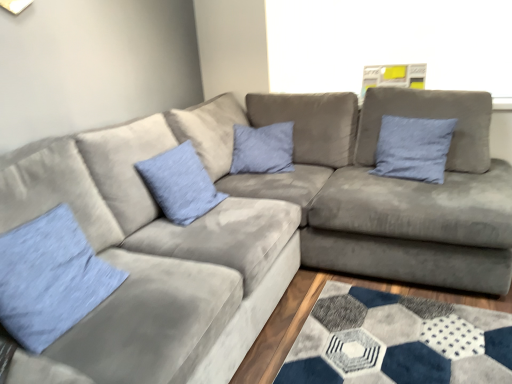
Question: Should I look upward or downward to see blue fabric pillow at center, which appears as the second pillow when viewed from the right?

Choices:
 (A) down
 (B) up

Answer: (B)

Question: Is blue fabric pillow at center, which appears as the second pillow when viewed from the right, aimed at light blue fabric pillow at lower left, the first pillow from the front?

Choices:
 (A) yes
 (B) no

Answer: (B)

Question: Is there a large distance between blue fabric pillow at center, the second pillow positioned from the front, and light blue fabric pillow at lower left, the first pillow from the front?

Choices:
 (A) yes
 (B) no

Answer: (B)

Question: From the image's perspective, is blue fabric pillow at center, which is counted as the 2th pillow, starting from the back, over light blue fabric pillow at lower left, the 1th pillow viewed from the left?

Choices:
 (A) yes
 (B) no

Answer: (A)

Question: Can you confirm if blue fabric pillow at center, which is counted as the 2th pillow, starting from the back, is bigger than light blue fabric pillow at lower left, the first pillow from the front?

Choices:
 (A) no
 (B) yes

Answer: (A)

Question: Is blue fabric pillow at center, the second pillow positioned from the front, to the right of light blue fabric pillow at lower left, which is counted as the third pillow, starting from the back, from the viewer's perspective?

Choices:
 (A) yes
 (B) no

Answer: (A)

Question: Is blue fabric pillow at center, the second pillow positioned from the front, further to camera compared to light blue fabric pillow at lower left, the first pillow from the front?

Choices:
 (A) yes
 (B) no

Answer: (A)

Question: Considering the relative sizes of light blue fabric pillow at lower left, the first pillow from the front, and blue fabric pillow at center, the second pillow positioned from the front, in the image provided, is light blue fabric pillow at lower left, the first pillow from the front, wider than blue fabric pillow at center, the second pillow positioned from the front,?

Choices:
 (A) no
 (B) yes

Answer: (B)

Question: From a real-world perspective, is light blue fabric pillow at lower left, which is counted as the third pillow, starting from the back, located beneath blue fabric pillow at center, acting as the second pillow starting from the left?

Choices:
 (A) yes
 (B) no

Answer: (A)

Question: Can you confirm if light blue fabric pillow at lower left, the first pillow from the front, is shorter than blue fabric pillow at center, which is counted as the 2th pillow, starting from the back?

Choices:
 (A) yes
 (B) no

Answer: (A)

Question: Is light blue fabric pillow at lower left, the 1th pillow viewed from the left, turned away from blue fabric pillow at center, acting as the second pillow starting from the left?

Choices:
 (A) yes
 (B) no

Answer: (B)

Question: Is light blue fabric pillow at lower left, the first pillow from the front, not close to blue fabric pillow at center, which is counted as the 2th pillow, starting from the back?

Choices:
 (A) no
 (B) yes

Answer: (A)

Question: Is light blue fabric pillow at lower left, the first pillow from the front, completely or partially outside of blue fabric pillow at center, which appears as the second pillow when viewed from the right?

Choices:
 (A) no
 (B) yes

Answer: (B)

Question: Does blue fabric pillow at upper right, which is counted as the 3th pillow, starting from the front, contain blue fabric pillow at center, the second pillow positioned from the front?

Choices:
 (A) yes
 (B) no

Answer: (B)